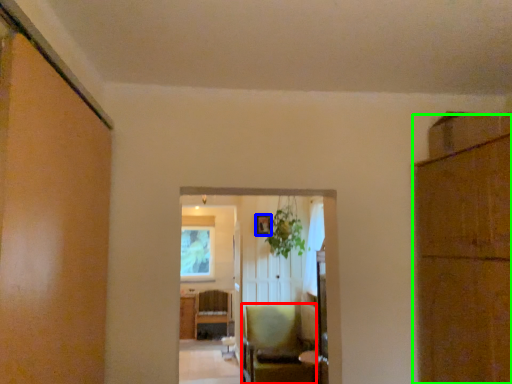
Question: Which object is the closest to the chair (highlighted by a red box)? Choose among these: picture frame (highlighted by a blue box) or cabinetry (highlighted by a green box).

Choices:
 (A) picture frame
 (B) cabinetry

Answer: (A)